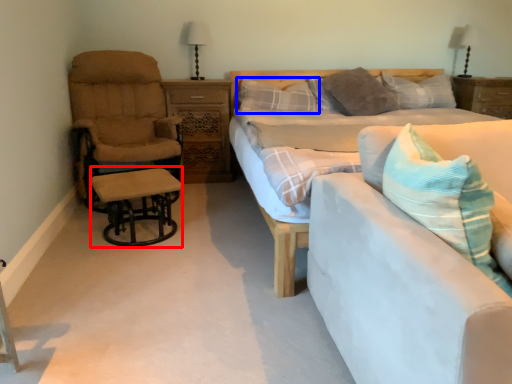
Question: Which of the following is the farthest to the observer, table (highlighted by a red box) or pillow (highlighted by a blue box)?

Choices:
 (A) table
 (B) pillow

Answer: (B)